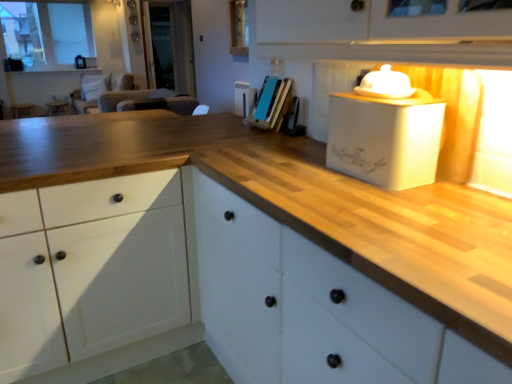
You are a GUI agent. You are given a task and a screenshot of the screen. Output one action in this format:
    pyautogui.click(x=<x>, y=<y>)
    Task: Click on the blue matte book at center
    This screenshot has height=384, width=512.
    Given the screenshot: What is the action you would take?
    pyautogui.click(x=272, y=105)

This screenshot has width=512, height=384. What do you see at coordinates (312, 310) in the screenshot? I see `white wood cabinet at center` at bounding box center [312, 310].

The image size is (512, 384). Describe the element at coordinates (386, 138) in the screenshot. I see `white matte box at upper right, which ranks as the second appliance in top-to-bottom order` at that location.

This screenshot has height=384, width=512. In order to click on blue matte book at center in this screenshot , I will do `click(272, 105)`.

Could you measure the distance between blue matte book at center and white matte box at upper right, which appears as the 1th appliance when ordered from the bottom?

They are 30.08 inches apart.

Looking at this image, can you confirm if blue matte book at center is bigger than white matte box at upper right, which ranks as the second appliance in top-to-bottom order?

No, blue matte book at center is not bigger than white matte box at upper right, which ranks as the second appliance in top-to-bottom order.

Which object is closer to the camera, blue matte book at center or white matte box at upper right, which ranks as the second appliance in top-to-bottom order?

Positioned in front is white matte box at upper right, which ranks as the second appliance in top-to-bottom order.

Based on their positions, is blue matte book at center located to the left or right of white matte box at upper right, which appears as the 1th appliance when ordered from the bottom?

Based on their positions, blue matte book at center is located to the left of white matte box at upper right, which appears as the 1th appliance when ordered from the bottom.

From a real-world perspective, is white wood cabinet at center physically located above or below white matte box at upper right, which appears as the 1th appliance when ordered from the bottom?

white wood cabinet at center is below white matte box at upper right, which appears as the 1th appliance when ordered from the bottom.

Is white wood cabinet at center placed right next to white matte box at upper right, which appears as the 1th appliance when ordered from the bottom?

No, white wood cabinet at center is not with white matte box at upper right, which appears as the 1th appliance when ordered from the bottom.

From the image's perspective, starting from the white wood cabinet at center, which appliance is the 1st one above? Please provide its 2D coordinates.

[(386, 138)]

Would you say white wood cabinet at center is inside or outside white matte box at upper right, which appears as the 1th appliance when ordered from the bottom?

white wood cabinet at center lies outside white matte box at upper right, which appears as the 1th appliance when ordered from the bottom.

Is transparent glass door at center to the right of white matte box at upper right, which appears as the 1th appliance when ordered from the bottom, from the viewer's perspective?

Incorrect, transparent glass door at center is not on the right side of white matte box at upper right, which appears as the 1th appliance when ordered from the bottom.

In the scene shown: From a real-world perspective, is transparent glass door at center physically above white matte box at upper right, which ranks as the second appliance in top-to-bottom order?

Yes, from a real-world perspective, transparent glass door at center is above white matte box at upper right, which ranks as the second appliance in top-to-bottom order.

Looking at this image, which is behind, transparent glass door at center or white matte box at upper right, which ranks as the second appliance in top-to-bottom order?

transparent glass door at center is behind.

Is transparent glass door at center far from white matte box at upper right, which appears as the 1th appliance when ordered from the bottom?

Yes, transparent glass door at center is far from white matte box at upper right, which appears as the 1th appliance when ordered from the bottom.

Which object is positioned more to the right, white glass window at upper left or blue matte book at center?

Positioned to the right is blue matte book at center.

Is white glass window at upper left positioned with its back to blue matte book at center?

No, white glass window at upper left is not facing the opposite direction of blue matte book at center.

Consider the image. How many degrees apart are the facing directions of white glass window at upper left and blue matte book at center?

The angle between the facing direction of white glass window at upper left and the facing direction of blue matte book at center is 90.3 degrees.

Do you think white glass window at upper left is within white wood cabinet at center, or outside of it?

white glass window at upper left exists outside the volume of white wood cabinet at center.

Considering the positions of objects white glass window at upper left and white wood cabinet at center in the image provided, who is more to the left, white glass window at upper left or white wood cabinet at center?

From the viewer's perspective, white glass window at upper left appears more on the left side.

How different are the orientations of white glass window at upper left and white wood cabinet at center in degrees?

white glass window at upper left and white wood cabinet at center are facing 89.8 degrees away from each other.

Considering the positions of objects white glass window at upper left and white wood cabinet at center in the image provided, who is in front, white glass window at upper left or white wood cabinet at center?

white wood cabinet at center is in front.

Is white glass window at upper left positioned beyond the bounds of transparent glass door at center?

That's correct, white glass window at upper left is outside of transparent glass door at center.

Relative to transparent glass door at center, is white glass window at upper left in front or behind?

In the image, white glass window at upper left appears in front of transparent glass door at center.

Based on their positions, is white glass window at upper left located to the left or right of transparent glass door at center?

Answer: From the image, it's evident that white glass window at upper left is to the left of transparent glass door at center.

Consider the image. How different are the orientations of white glass window at upper left and transparent glass door at center in degrees?

1.51 degrees separate the facing orientations of white glass window at upper left and transparent glass door at center.

Is blue matte book at center far from transparent glass door at center?

blue matte book at center is far away from transparent glass door at center.

From a real-world perspective, between blue matte book at center and transparent glass door at center, who is vertically lower?

blue matte book at center.

Measure the distance from blue matte book at center to transparent glass door at center.

blue matte book at center is 17.40 feet from transparent glass door at center.

Can you confirm if blue matte book at center is positioned to the right of transparent glass door at center?

Yes.

The width and height of the screenshot is (512, 384). Find the location of `appliance below the blue matte book at center (from a real-world perspective)`. appliance below the blue matte book at center (from a real-world perspective) is located at coordinates (386, 138).

Find the location of `cabinetry lying in front of the white matte box at upper right, which ranks as the second appliance in top-to-bottom order`. cabinetry lying in front of the white matte box at upper right, which ranks as the second appliance in top-to-bottom order is located at coordinates (312, 310).

When comparing their distances from transparent glass door at center, does white wood cabinet at center or white ceramic lid at upper right, the 2th appliance ordered from the bottom, seem closer?

Among the two, white wood cabinet at center is located nearer to transparent glass door at center.

Which object lies nearer to the anchor point white matte box at upper right, which ranks as the second appliance in top-to-bottom order, blue matte book at center or transparent glass door at center?

blue matte book at center lies closer to white matte box at upper right, which ranks as the second appliance in top-to-bottom order, than the other object.

Looking at the image, which one is located further to white ceramic lid at upper right, the 1th appliance when ordered from top to bottom, white matte box at upper right, which ranks as the second appliance in top-to-bottom order, or transparent glass door at center?

transparent glass door at center lies further to white ceramic lid at upper right, the 1th appliance when ordered from top to bottom, than the other object.

Based on their spatial positions, is transparent glass door at center or white ceramic lid at upper right, the 2th appliance ordered from the bottom, closer to white glass window at upper left?

transparent glass door at center is positioned closer to the anchor white glass window at upper left.

Based on their spatial positions, is white glass window at upper left or blue matte book at center closer to transparent glass door at center?

Based on the image, white glass window at upper left appears to be nearer to transparent glass door at center.

Looking at the image, which one is located closer to white wood cabinet at center, white ceramic lid at upper right, the 2th appliance ordered from the bottom, or white glass window at upper left?

Based on the image, white ceramic lid at upper right, the 2th appliance ordered from the bottom, appears to be nearer to white wood cabinet at center.

Based on the photo, which object lies further to the anchor point white ceramic lid at upper right, the 1th appliance when ordered from top to bottom, white wood cabinet at center or transparent glass door at center?

Based on the image, transparent glass door at center appears to be further to white ceramic lid at upper right, the 1th appliance when ordered from top to bottom.

Considering their positions, is transparent glass door at center positioned further to white ceramic lid at upper right, the 2th appliance ordered from the bottom, than white wood cabinet at center?

transparent glass door at center is further to white ceramic lid at upper right, the 2th appliance ordered from the bottom.

This screenshot has height=384, width=512. What are the coordinates of `window located between white ceramic lid at upper right, the 1th appliance when ordered from top to bottom, and transparent glass door at center in the depth direction` in the screenshot? It's located at (47, 33).

Locate an element on the screen. book between white ceramic lid at upper right, the 2th appliance ordered from the bottom, and transparent glass door at center, along the z-axis is located at coordinates (272, 105).

You are a GUI agent. You are given a task and a screenshot of the screen. Output one action in this format:
    pyautogui.click(x=<x>, y=<y>)
    Task: Click on the appliance located between white matte box at upper right, which ranks as the second appliance in top-to-bottom order, and white glass window at upper left in the depth direction
    The height and width of the screenshot is (384, 512).
    Given the screenshot: What is the action you would take?
    pyautogui.click(x=385, y=84)

Locate an element on the screen. This screenshot has width=512, height=384. book between white matte box at upper right, which ranks as the second appliance in top-to-bottom order, and transparent glass door at center from front to back is located at coordinates (272, 105).